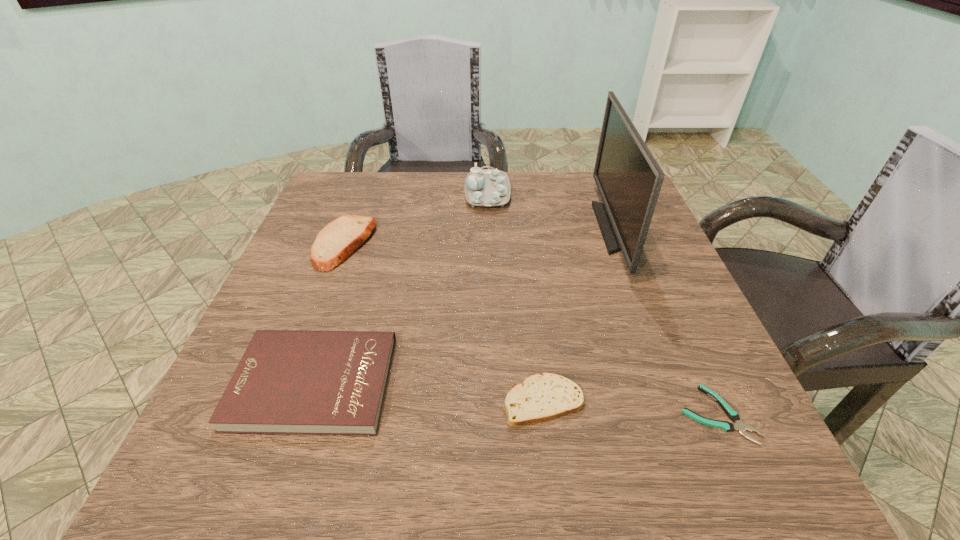
Find the location of a particular element. pliers present at the near edge is located at coordinates (733, 415).

In order to click on pita bread that is at the left edge in this screenshot , I will do `click(340, 238)`.

I want to click on hardback book present at the left edge, so click(x=306, y=382).

Where is `monitor that is at the right edge`? This screenshot has height=540, width=960. monitor that is at the right edge is located at coordinates (629, 179).

This screenshot has height=540, width=960. Find the location of `pliers located at the right edge`. pliers located at the right edge is located at coordinates (733, 415).

The height and width of the screenshot is (540, 960). In order to click on object situated at the far left corner in this screenshot , I will do `click(340, 238)`.

Identify the location of object that is at the near left corner. (306, 382).

Where is `object present at the far right corner`? The image size is (960, 540). object present at the far right corner is located at coordinates (629, 179).

At what (x,y) coordinates should I click in order to perform the action: click on object that is at the near right corner. Please return your answer as a coordinate pair (x, y). The width and height of the screenshot is (960, 540). Looking at the image, I should click on (733, 415).

Image resolution: width=960 pixels, height=540 pixels. I want to click on vacant space at the far edge of the desktop, so click(560, 206).